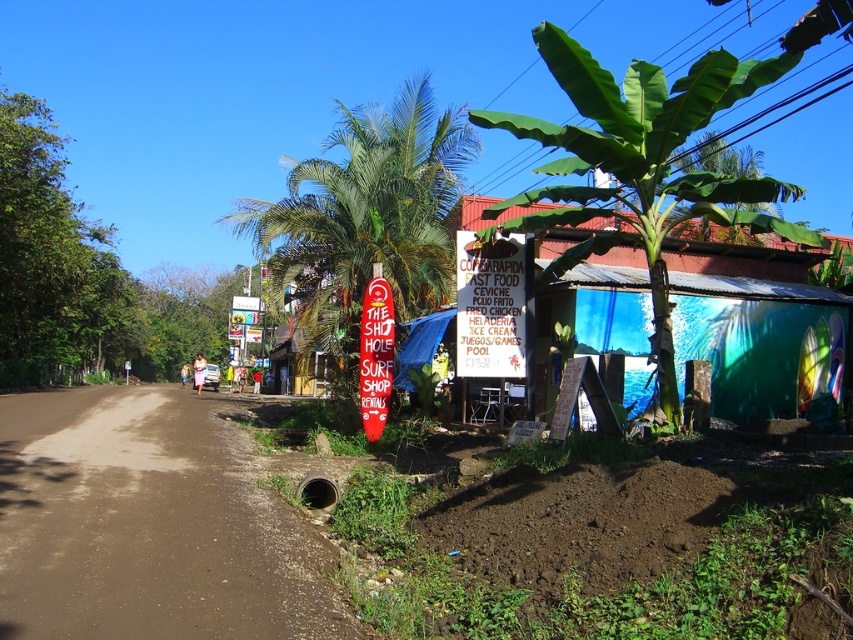
Between brown dirt track at lower left and white paper sign at center, which one appears on the left side from the viewer's perspective?

Positioned to the left is brown dirt track at lower left.

Between point (305, 560) and point (509, 269), which one is positioned in front?

Positioned in front is point (305, 560).

Is point (30, 627) behind point (483, 346)?

No, it is not.

Where is `brown dirt track at lower left`? The height and width of the screenshot is (640, 853). brown dirt track at lower left is located at coordinates (148, 524).

Based on the photo, is white paper sign at center to the right of red plastic sign at center from the viewer's perspective?

Correct, you'll find white paper sign at center to the right of red plastic sign at center.

Is white paper sign at center smaller than red plastic sign at center?

No.

Between point (457, 362) and point (384, 312), which one is positioned in front?

Point (457, 362) is more forward.

The height and width of the screenshot is (640, 853). I want to click on white paper sign at center, so click(490, 307).

Between brown dirt track at lower left and red plastic sign at center, which one appears on the left side from the viewer's perspective?

Positioned to the left is brown dirt track at lower left.

Can you confirm if brown dirt track at lower left is shorter than red plastic sign at center?

Yes.

Identify the location of brown dirt track at lower left. (148, 524).